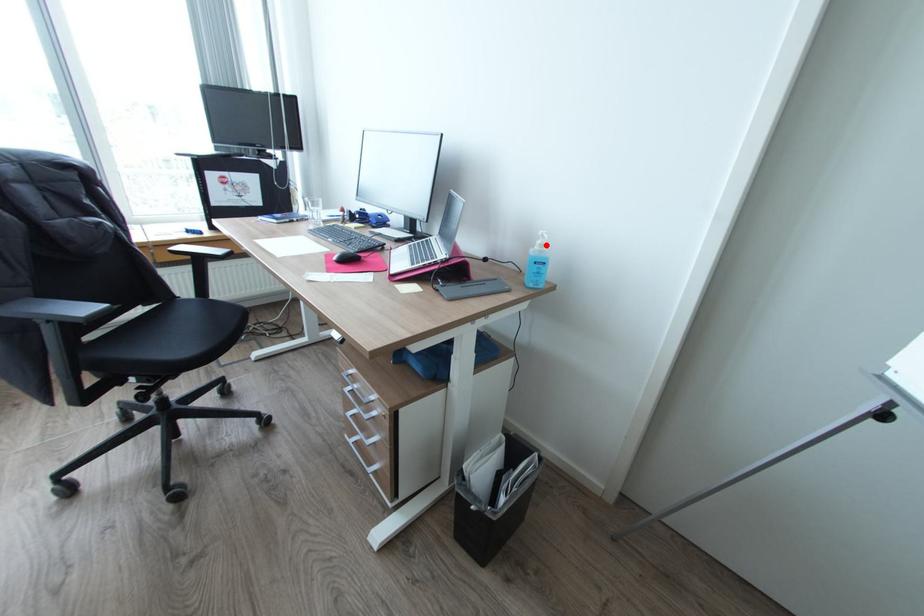
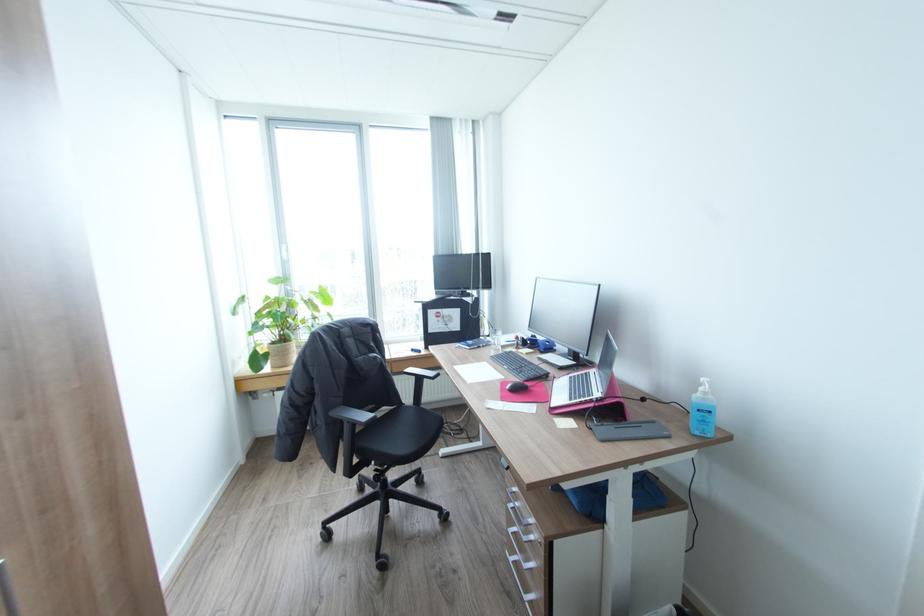
Question: I am providing you with two images of the same scene from different viewpoints. A red point is marked on the first image. Is the red point's position out of view in image 2?

Choices:
 (A) Yes
 (B) No

Answer: (B)